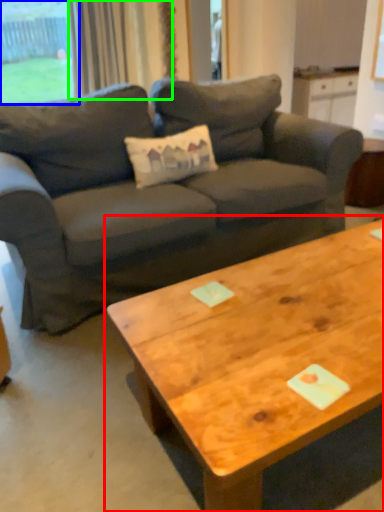
Question: Which object is the farthest from coffee table (highlighted by a red box)? Choose among these: window (highlighted by a blue box) or curtain (highlighted by a green box).

Choices:
 (A) window
 (B) curtain

Answer: (A)